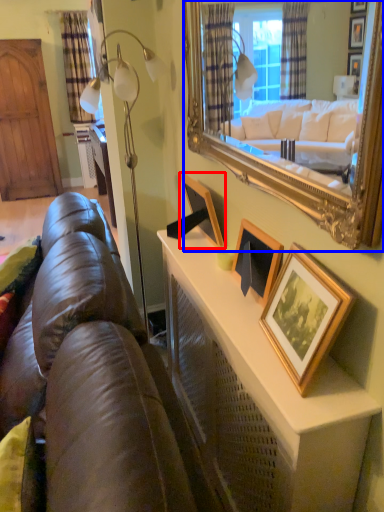
Question: Which point is closer to the camera, picture frame (highlighted by a red box) or mirror (highlighted by a blue box)?

Choices:
 (A) picture frame
 (B) mirror

Answer: (B)